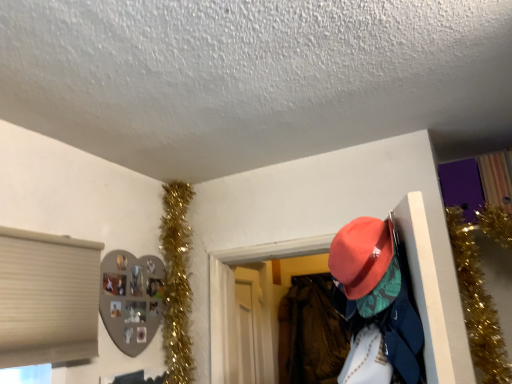
Where is `matte orange hat at upper right`? matte orange hat at upper right is located at coordinates (374, 305).

You are a GUI agent. You are given a task and a screenshot of the screen. Output one action in this format:
    pyautogui.click(x=<x>, y=<y>)
    Task: Click on the velvet-like orange hat at center-right
    
    Given the screenshot: What is the action you would take?
    pyautogui.click(x=311, y=333)

Looking at this image, from the image's perspective, which is below, matte orange hat at upper right or velvet-like orange hat at center-right?

velvet-like orange hat at center-right is shown below in the image.

Relative to velvet-like orange hat at center-right, is matte orange hat at upper right in front or behind?

matte orange hat at upper right is positioned closer to the viewer than velvet-like orange hat at center-right.

Is matte orange hat at upper right next to velvet-like orange hat at center-right and touching it?

No, matte orange hat at upper right is not next to velvet-like orange hat at center-right.

How many degrees apart are the facing directions of gold tinsel garland at upper left and matte orange hat at upper right?

gold tinsel garland at upper left and matte orange hat at upper right are facing 155 degrees away from each other.

From the image's perspective, is gold tinsel garland at upper left positioned above or below matte orange hat at upper right?

gold tinsel garland at upper left is below matte orange hat at upper right.

Measure the distance from gold tinsel garland at upper left to matte orange hat at upper right.

gold tinsel garland at upper left is 3.72 feet away from matte orange hat at upper right.

Considering the relative sizes of gold tinsel garland at upper left and matte orange hat at upper right in the image provided, is gold tinsel garland at upper left shorter than matte orange hat at upper right?

Incorrect, the height of gold tinsel garland at upper left does not fall short of that of matte orange hat at upper right.

Is gold tinsel garland at upper left turned away from velvet-like orange hat at center-right?

gold tinsel garland at upper left does not have its back to velvet-like orange hat at center-right.

In the scene shown: Does gold tinsel garland at upper left contain velvet-like orange hat at center-right?

No, velvet-like orange hat at center-right is not inside gold tinsel garland at upper left.

Considering the relative positions of gold tinsel garland at upper left and velvet-like orange hat at center-right in the image provided, is gold tinsel garland at upper left to the right of velvet-like orange hat at center-right from the viewer's perspective?

No, gold tinsel garland at upper left is not to the right of velvet-like orange hat at center-right.

Considering the positions of objects gold tinsel garland at upper left and velvet-like orange hat at center-right in the image provided, who is in front, gold tinsel garland at upper left or velvet-like orange hat at center-right?

gold tinsel garland at upper left is in front.

Is velvet-like orange hat at center-right taller than matte orange hat at upper right?

Yes, velvet-like orange hat at center-right is taller than matte orange hat at upper right.

Based on the photo, is matte orange hat at upper right at the back of velvet-like orange hat at center-right?

No, velvet-like orange hat at center-right is not facing away from matte orange hat at upper right.

Can you tell me how much velvet-like orange hat at center-right and matte orange hat at upper right differ in facing direction?

64.3 degrees.

Image resolution: width=512 pixels, height=384 pixels. Find the location of `clothing below the matte orange hat at upper right (from the image's perspective)`. clothing below the matte orange hat at upper right (from the image's perspective) is located at coordinates (311, 333).

From the picture: In terms of height, does velvet-like orange hat at center-right look taller or shorter compared to gold tinsel garland at upper left?

In the image, velvet-like orange hat at center-right appears to be shorter than gold tinsel garland at upper left.

Is gold tinsel garland at upper left inside velvet-like orange hat at center-right?

No, velvet-like orange hat at center-right does not contain gold tinsel garland at upper left.

What's the angular difference between velvet-like orange hat at center-right and gold tinsel garland at upper left's facing directions?

A: The angle between the facing direction of velvet-like orange hat at center-right and the facing direction of gold tinsel garland at upper left is 90.5 degrees.

From the image's perspective, is velvet-like orange hat at center-right above gold tinsel garland at upper left?

Actually, velvet-like orange hat at center-right appears below gold tinsel garland at upper left in the image.

Is matte orange hat at upper right looking in the opposite direction of gold tinsel garland at upper left?

No, matte orange hat at upper right is not facing the opposite direction of gold tinsel garland at upper left.

Considering the sizes of objects matte orange hat at upper right and gold tinsel garland at upper left in the image provided, who is wider, matte orange hat at upper right or gold tinsel garland at upper left?

gold tinsel garland at upper left.

Which object is closer to the camera taking this photo, matte orange hat at upper right or gold tinsel garland at upper left?

matte orange hat at upper right is more forward.

This screenshot has height=384, width=512. I want to click on christmas decoration behind the matte orange hat at upper right, so click(x=177, y=283).

Locate an element on the screen. Image resolution: width=512 pixels, height=384 pixels. person above the velvet-like orange hat at center-right (from the image's perspective) is located at coordinates (374, 305).

Where is `christmas decoration behind the matte orange hat at upper right`? This screenshot has width=512, height=384. christmas decoration behind the matte orange hat at upper right is located at coordinates (177, 283).

Considering their positions, is matte orange hat at upper right positioned further to velvet-like orange hat at center-right than gold tinsel garland at upper left?

matte orange hat at upper right.

Consider the image. Based on their spatial positions, is matte orange hat at upper right or velvet-like orange hat at center-right closer to gold tinsel garland at upper left?

Based on the image, matte orange hat at upper right appears to be nearer to gold tinsel garland at upper left.

From the image, which object appears to be nearer to gold tinsel garland at upper left, velvet-like orange hat at center-right or matte orange hat at upper right?

Among the two, matte orange hat at upper right is located nearer to gold tinsel garland at upper left.

Estimate the real-world distances between objects in this image. Which object is further from velvet-like orange hat at center-right, gold tinsel garland at upper left or matte orange hat at upper right?

matte orange hat at upper right.

When comparing their distances from matte orange hat at upper right, does gold tinsel garland at upper left or velvet-like orange hat at center-right seem closer?

gold tinsel garland at upper left is closer to matte orange hat at upper right.

When comparing their distances from matte orange hat at upper right, does velvet-like orange hat at center-right or gold tinsel garland at upper left seem further?

Among the two, velvet-like orange hat at center-right is located further to matte orange hat at upper right.

You are a GUI agent. You are given a task and a screenshot of the screen. Output one action in this format:
    pyautogui.click(x=<x>, y=<y>)
    Task: Click on the christmas decoration between matte orange hat at upper right and velvet-like orange hat at center-right along the z-axis
    The width and height of the screenshot is (512, 384).
    Given the screenshot: What is the action you would take?
    pyautogui.click(x=177, y=283)